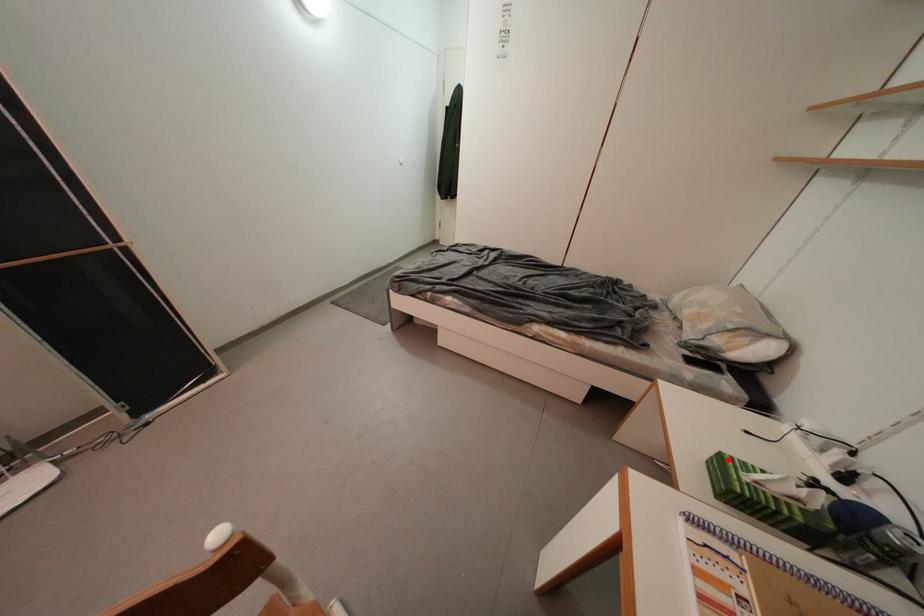
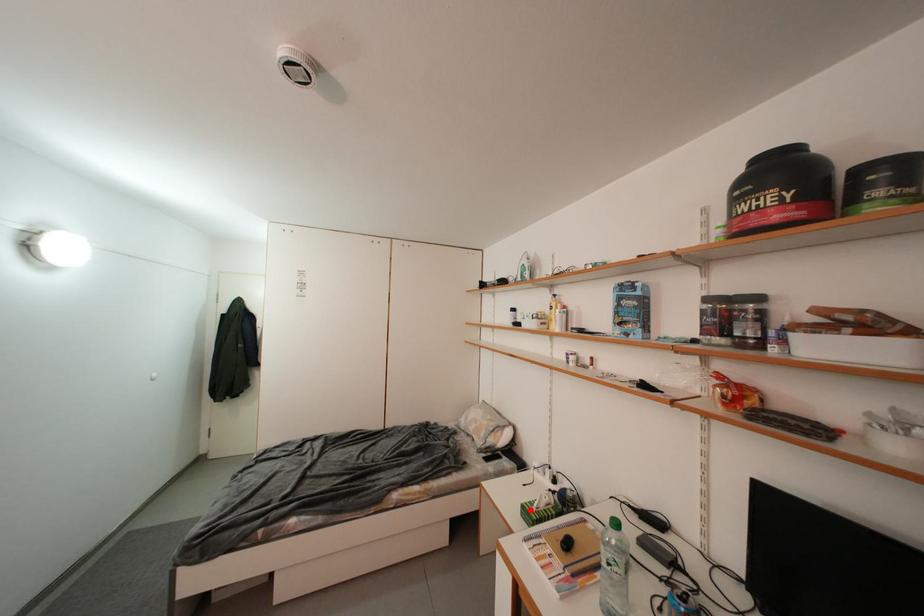
I am providing you with two images of the same scene from different viewpoints. A red point is marked on the first image and another point is marked on the second image. Is the red point in image1 aligned with the point shown in image2?

Yes